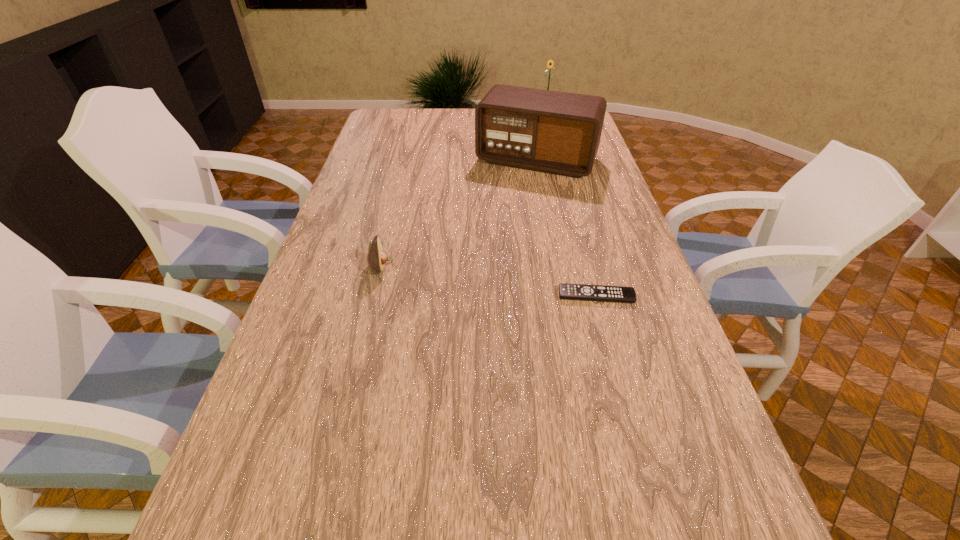
Identify the location of free spot at the near edge of the desktop. Image resolution: width=960 pixels, height=540 pixels. (503, 492).

The height and width of the screenshot is (540, 960). Identify the location of vacant area at the left edge. (296, 433).

This screenshot has width=960, height=540. Identify the location of free region at the right edge of the desktop. (663, 448).

Identify the location of vacant space at the far left corner of the desktop. (382, 126).

In the image, there is a desktop. At what (x,y) coordinates should I click in order to perform the action: click on vacant area at the near right corner. Please return your answer as a coordinate pair (x, y). The width and height of the screenshot is (960, 540). Looking at the image, I should click on click(727, 463).

Image resolution: width=960 pixels, height=540 pixels. I want to click on vacant area that lies between the sunflower and the nearest object, so click(x=571, y=206).

This screenshot has width=960, height=540. What are the coordinates of `free space between the shortest object and the second farthest object` in the screenshot? It's located at (566, 228).

Find the location of a particular element. This screenshot has height=540, width=960. unoccupied area between the shortest object and the farthest object is located at coordinates (571, 206).

Locate an element on the screen. The image size is (960, 540). free area in between the shortest object and the radio receiver is located at coordinates (566, 228).

Where is `empty space between the shortest object and the third nearest object`? This screenshot has width=960, height=540. empty space between the shortest object and the third nearest object is located at coordinates (566, 228).